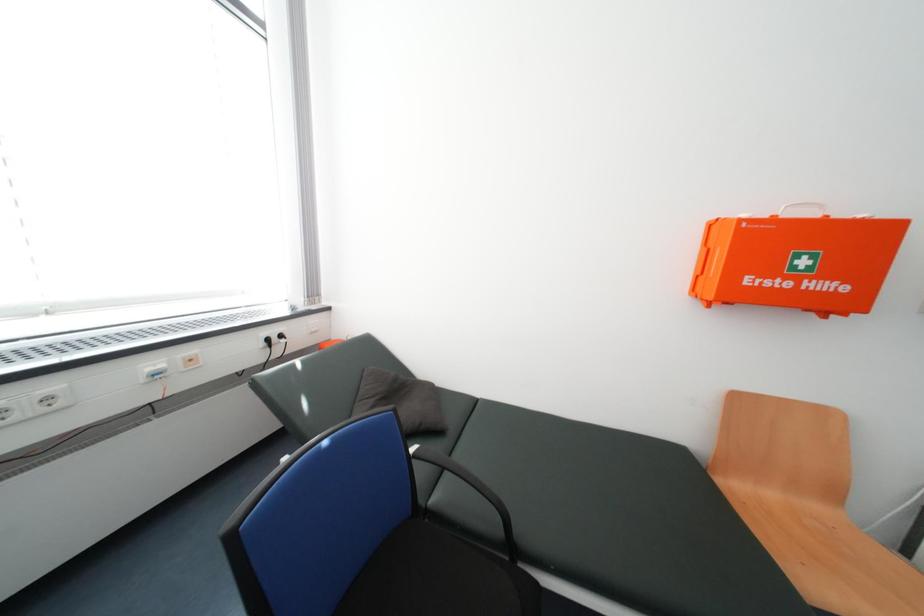
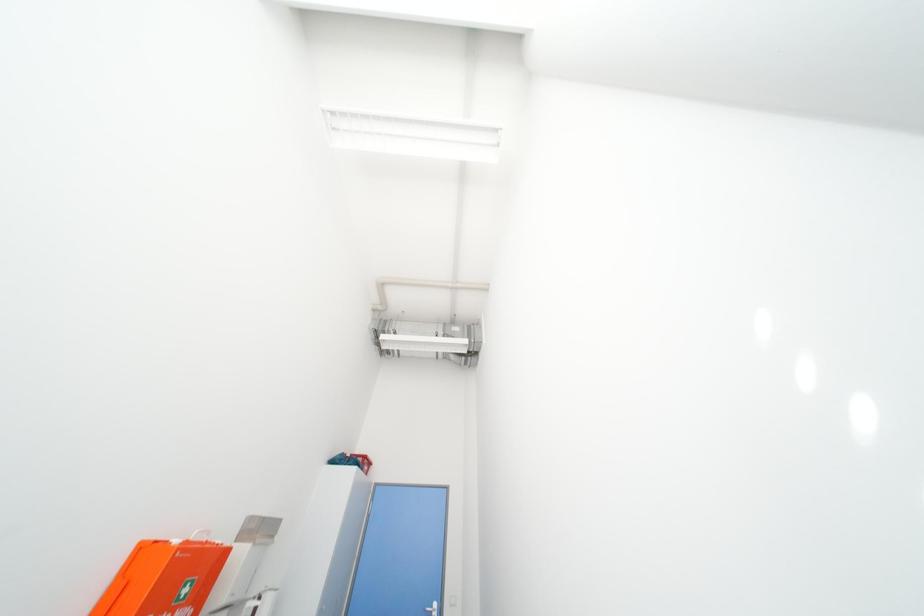
The first image is from the beginning of the video and the second image is from the end. How did the camera likely rotate when shooting the video?

The camera's rotation is toward right-up.